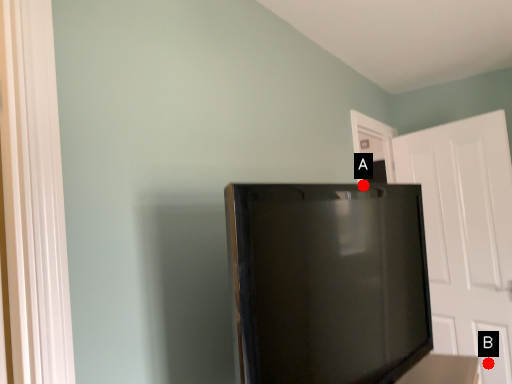
Question: Two points are circled on the image, labeled by A and B beside each circle. Which point is further to the camera?

Choices:
 (A) A is further
 (B) B is further

Answer: (B)